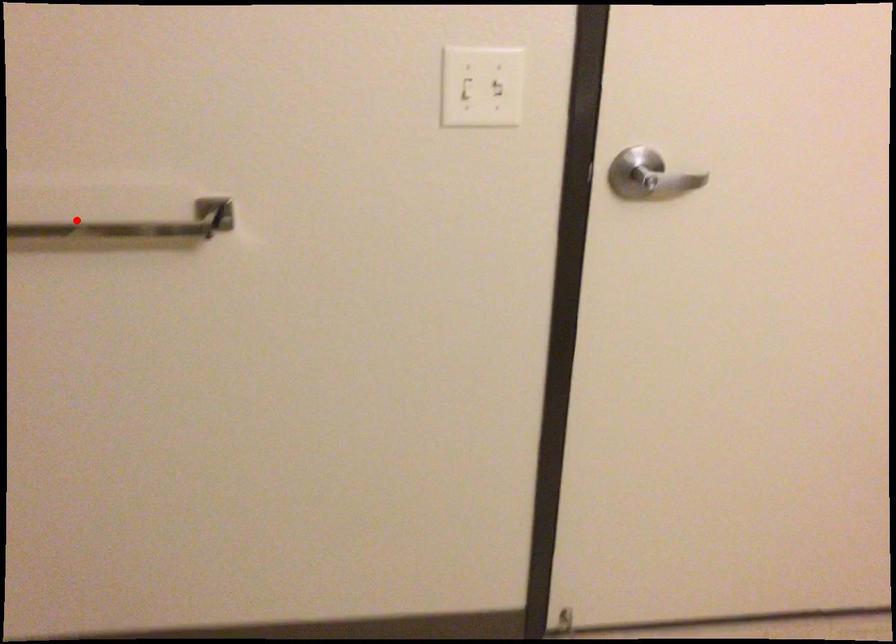
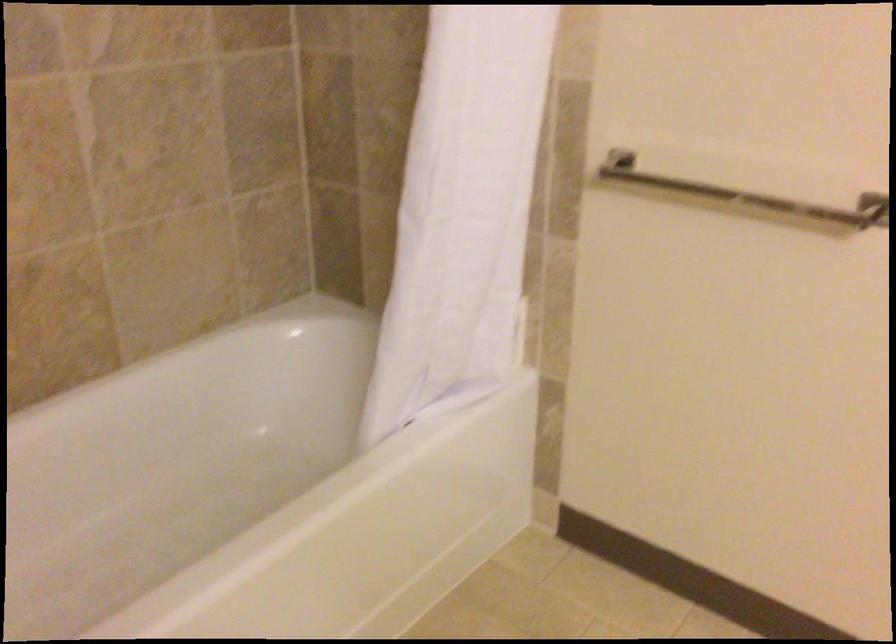
Find the pixel in the second image that matches the highlighted location in the first image.

(745, 194)